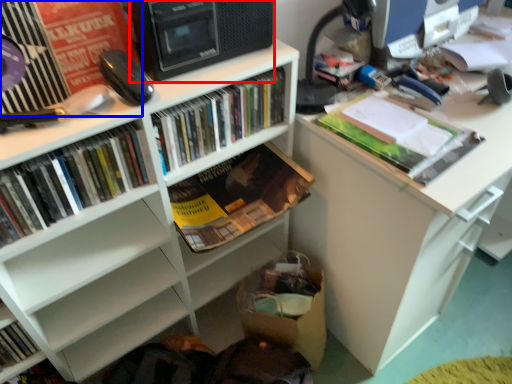
Question: Which object appears farthest to the camera in this image, computer tower (highlighted by a red box) or shelf (highlighted by a blue box)?

Choices:
 (A) computer tower
 (B) shelf

Answer: (A)